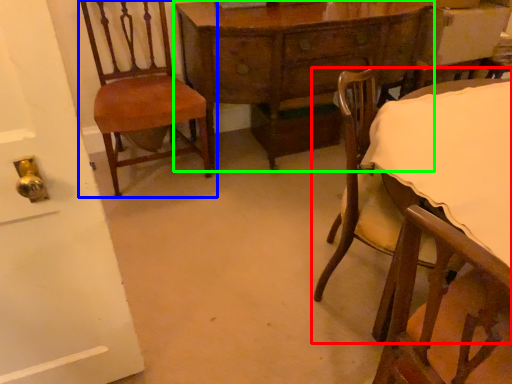
Question: Which is farther away from chair (highlighted by a red box)? chair (highlighted by a blue box) or table (highlighted by a green box)?

Choices:
 (A) chair
 (B) table

Answer: (A)